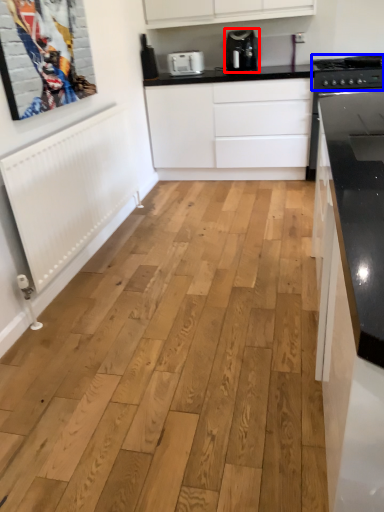
Question: Which object appears farthest to the camera in this image, home appliance (highlighted by a red box) or stove (highlighted by a blue box)?

Choices:
 (A) home appliance
 (B) stove

Answer: (A)